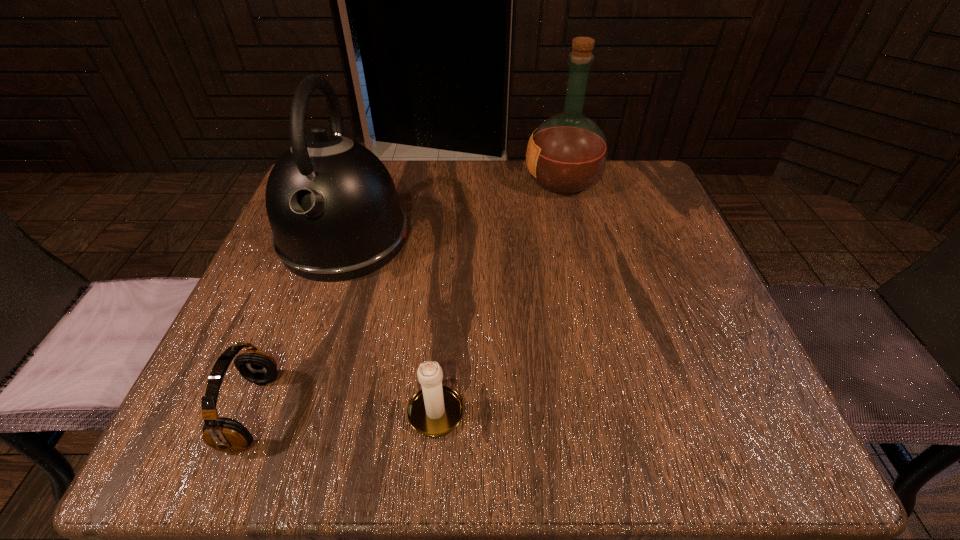
I want to click on liquor, so click(567, 153).

Find the location of `kettle`. kettle is located at coordinates (332, 205).

Where is `the third object from left to right`? The image size is (960, 540). the third object from left to right is located at coordinates (434, 411).

At what (x,y) coordinates should I click in order to perform the action: click on headset. Please return your answer as a coordinate pair (x, y). Looking at the image, I should click on (223, 434).

Where is `vacant space located on the front label of the liquor`? vacant space located on the front label of the liquor is located at coordinates (449, 181).

Identify the location of vacant region located on the front label of the liquor. The height and width of the screenshot is (540, 960). (445, 181).

Locate an element on the screen. This screenshot has height=540, width=960. vacant space located on the front label of the liquor is located at coordinates (392, 181).

Where is `vacant space situated on the spout of the kettle`? vacant space situated on the spout of the kettle is located at coordinates (295, 386).

Where is `blank space located on the handle side of the second object from right to left`? Image resolution: width=960 pixels, height=540 pixels. blank space located on the handle side of the second object from right to left is located at coordinates (445, 293).

Where is `free location located on the handle side of the second object from right to left`? The image size is (960, 540). free location located on the handle side of the second object from right to left is located at coordinates (444, 314).